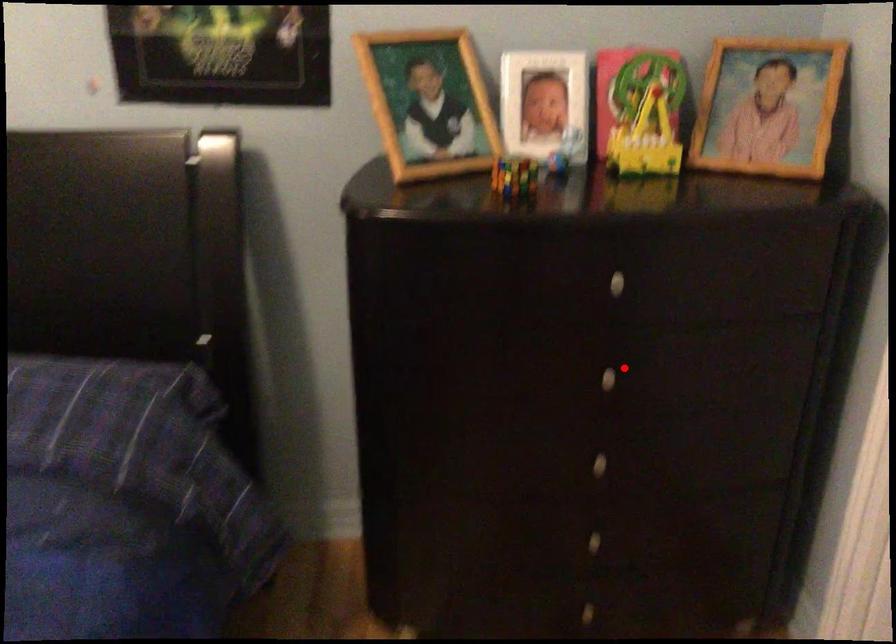
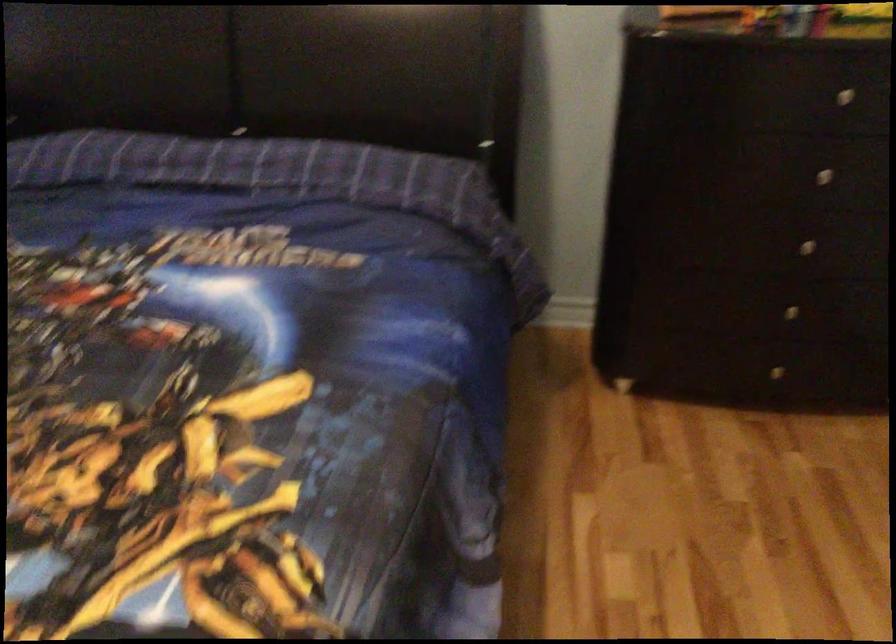
Locate, in the second image, the point that corresponds to the highlighted location in the first image.

(833, 169)